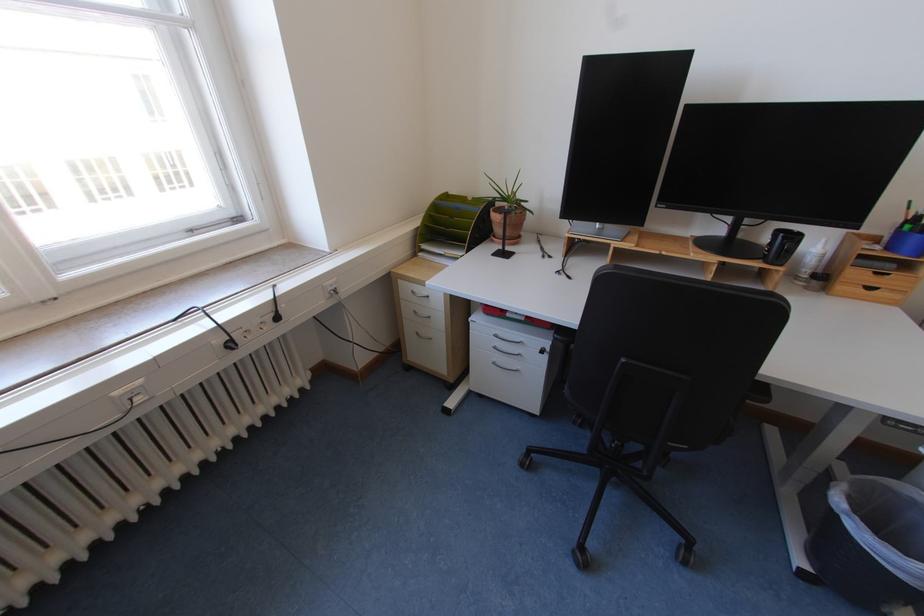
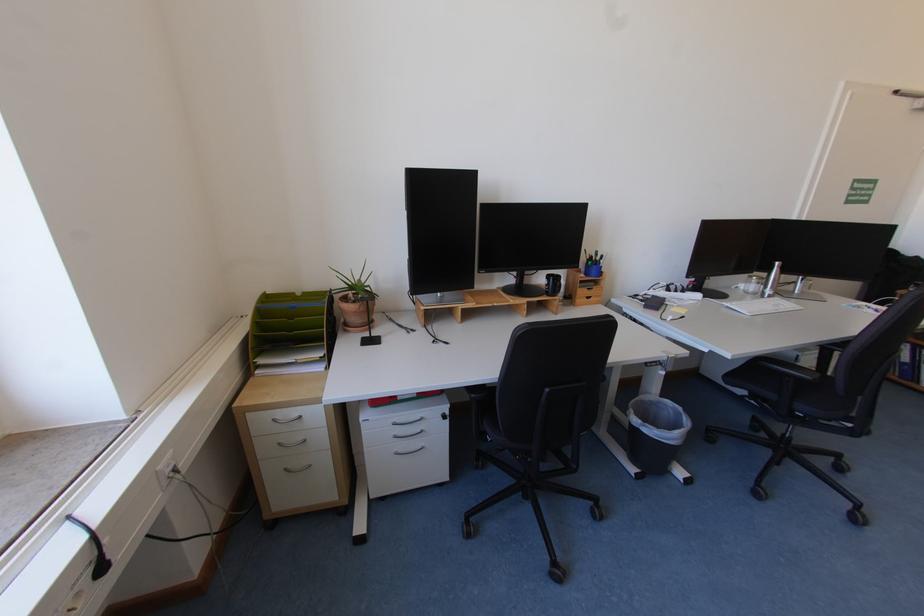
Question: The images are taken continuously from a first-person perspective. In which direction is your viewpoint rotating?

Choices:
 (A) Left
 (B) Right
 (C) Up
 (D) Down

Answer: (B)